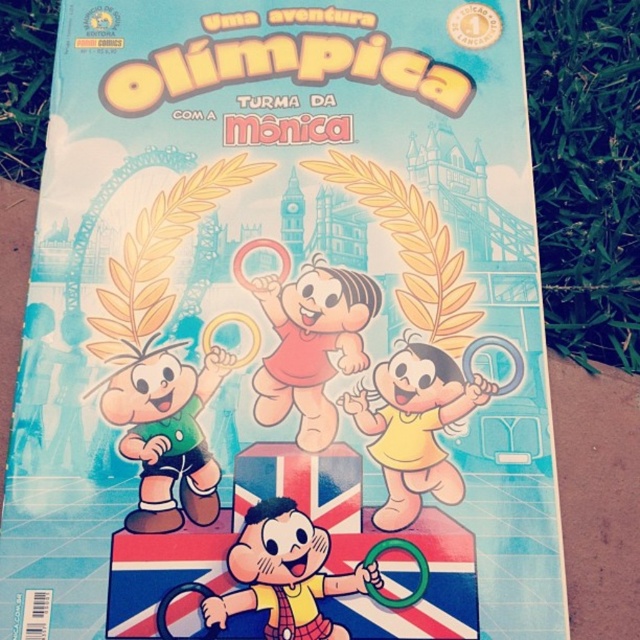
Does matte orange ring at center have a greater width compared to yellow matte plush toy at center?

No, matte orange ring at center is not wider than yellow matte plush toy at center.

Locate an element on the screen. matte orange ring at center is located at coordinates (310, 344).

Locate an element on the screen. This screenshot has height=640, width=640. matte orange ring at center is located at coordinates (310, 344).

Between green grass at right and green matte shorts at lower left, which one is positioned higher?

Positioned higher is green grass at right.

Between point (579, 65) and point (204, 509), which one is positioned in front?

Point (204, 509) is more forward.

Find the location of a particular element. This screenshot has width=640, height=640. green grass at right is located at coordinates (586, 172).

Which is above, green matte shorts at lower left or green grass at upper left?

green grass at upper left is above.

Is point (208, 524) positioned behind point (22, 4)?

That is False.

Who is more distant from viewer, (216, 378) or (40, 10)?

Positioned behind is point (40, 10).

The image size is (640, 640). I want to click on green matte shorts at lower left, so click(x=168, y=435).